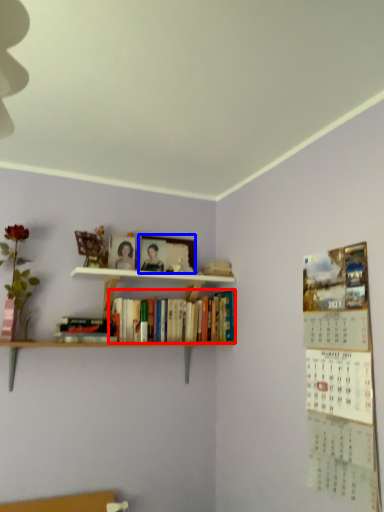
Question: Which object appears closest to the camera in this image, book (highlighted by a red box) or picture frame (highlighted by a blue box)?

Choices:
 (A) book
 (B) picture frame

Answer: (A)